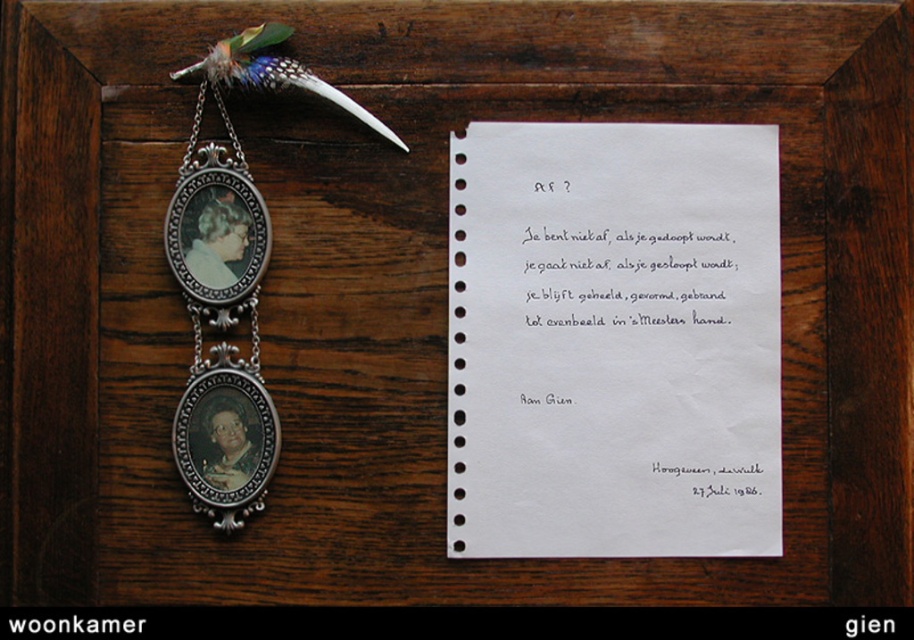
Question: Is white paper at center to the right of silver/metallic pendant at left from the viewer's perspective?

Choices:
 (A) no
 (B) yes

Answer: (B)

Question: Is white paper at center bigger than silver/metallic pendant at left?

Choices:
 (A) yes
 (B) no

Answer: (A)

Question: Which point is farther to the camera?

Choices:
 (A) tap(195, 432)
 (B) tap(455, 513)

Answer: (B)

Question: Can you confirm if white paper at center is positioned to the left of silver/metallic pendant at left?

Choices:
 (A) no
 (B) yes

Answer: (A)

Question: Which of the following is the closest to the observer?

Choices:
 (A) (465, 476)
 (B) (207, 310)

Answer: (B)